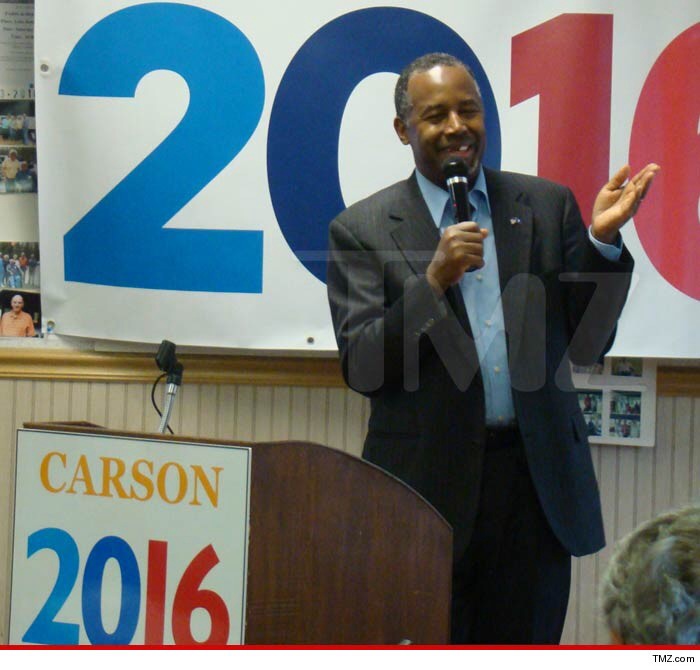
The width and height of the screenshot is (700, 670). I want to click on wall, so click(x=649, y=484).